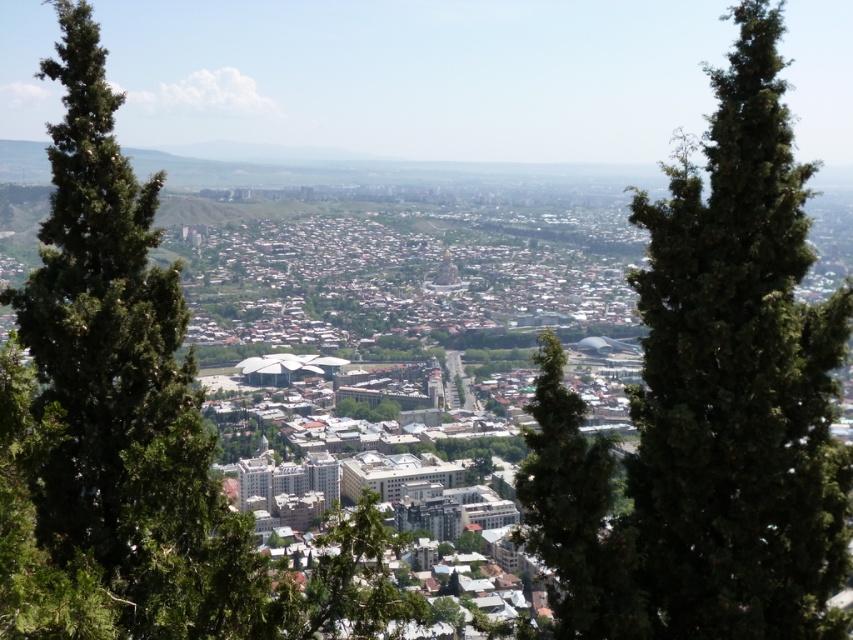
Question: Considering the relative positions of green textured tree at center and green leafy tree at left in the image provided, where is green textured tree at center located with respect to green leafy tree at left?

Choices:
 (A) below
 (B) above

Answer: (B)

Question: Observing the image, what is the correct spatial positioning of green textured tree at center in reference to green leafy tree at left?

Choices:
 (A) left
 (B) right

Answer: (B)

Question: Among these objects, which one is farthest from the camera?

Choices:
 (A) green leafy tree at left
 (B) green textured tree at center

Answer: (B)

Question: Which point is farther from the camera taking this photo?

Choices:
 (A) (161, 365)
 (B) (759, 164)

Answer: (B)

Question: Does green textured tree at center appear on the right side of green leafy tree at left?

Choices:
 (A) no
 (B) yes

Answer: (B)

Question: Which point is farther to the camera?

Choices:
 (A) (759, 612)
 (B) (108, 353)

Answer: (A)